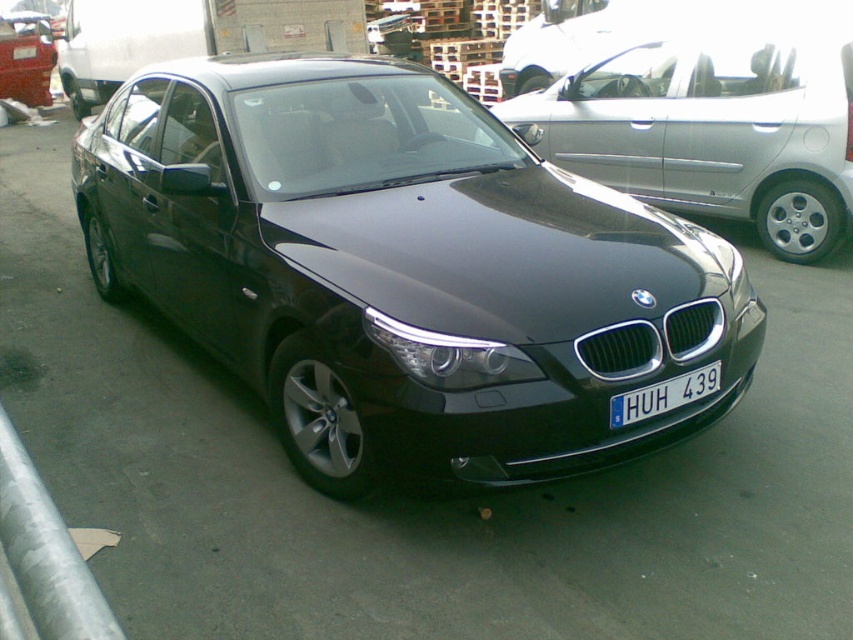
Question: Which of these objects is positioned closest to the metallic gray curb at lower left?

Choices:
 (A) satin black car at center
 (B) glossy black car at center

Answer: (B)

Question: Which object appears farthest from the camera in this image?

Choices:
 (A) glossy black car at center
 (B) metallic gray curb at lower left
 (C) blue metallic license plate at center

Answer: (C)

Question: Can you confirm if metallic gray curb at lower left is wider than blue metallic license plate at center?

Choices:
 (A) no
 (B) yes

Answer: (B)

Question: Does satin black car at center have a smaller size compared to metallic gray curb at lower left?

Choices:
 (A) no
 (B) yes

Answer: (A)

Question: Does glossy black car at center come behind satin black car at center?

Choices:
 (A) yes
 (B) no

Answer: (B)

Question: Which of the following is the farthest from the observer?

Choices:
 (A) (387, 163)
 (B) (592, 108)

Answer: (B)